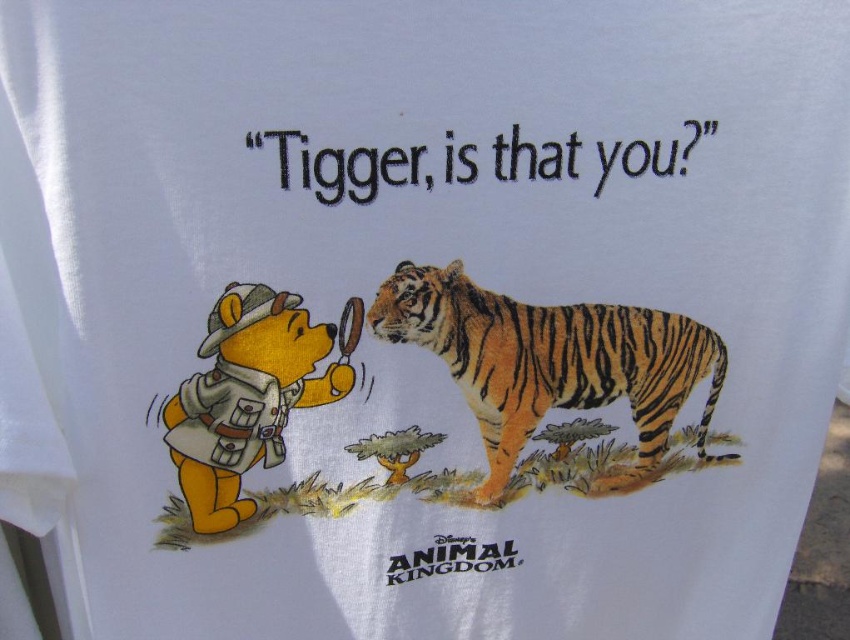
Question: Which object is farther from the camera taking this photo?

Choices:
 (A) matte yellow bear at left
 (B) orange-brown striped tiger at center

Answer: (B)

Question: Where is orange-brown striped tiger at center located in relation to matte yellow bear at left in the image?

Choices:
 (A) below
 (B) above

Answer: (A)

Question: Can you confirm if orange-brown striped tiger at center is smaller than matte yellow bear at left?

Choices:
 (A) yes
 (B) no

Answer: (B)

Question: Which object is closer to the camera taking this photo?

Choices:
 (A) orange-brown striped tiger at center
 (B) matte yellow bear at left

Answer: (B)

Question: Is orange-brown striped tiger at center in front of matte yellow bear at left?

Choices:
 (A) no
 (B) yes

Answer: (A)